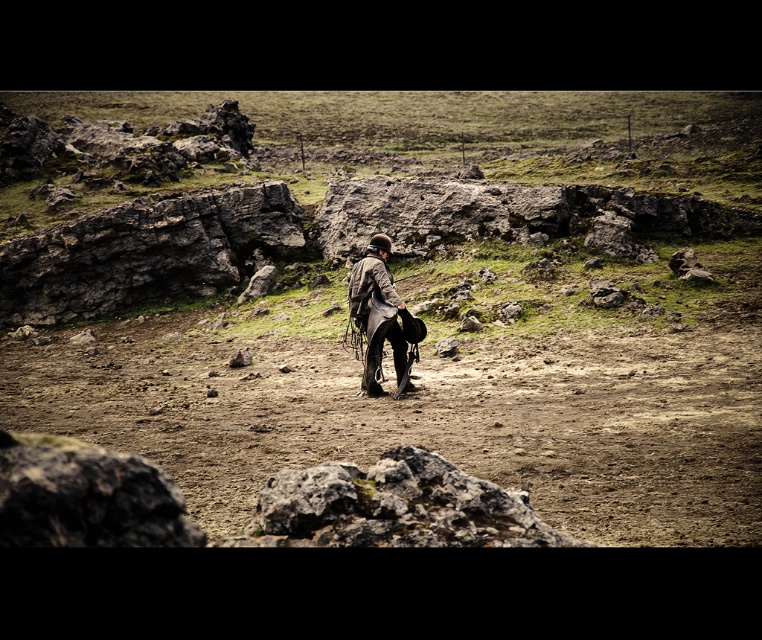
Question: Does dull gray rock at center have a smaller size compared to leather jacket at center?

Choices:
 (A) yes
 (B) no

Answer: (B)

Question: Which object appears farthest from the camera in this image?

Choices:
 (A) leather jacket at center
 (B) dull gray rock at center

Answer: (B)

Question: Is dull gray rock at center wider than leather jacket at center?

Choices:
 (A) yes
 (B) no

Answer: (A)

Question: Can you confirm if dull gray rock at center is positioned to the left of leather jacket at center?

Choices:
 (A) yes
 (B) no

Answer: (A)